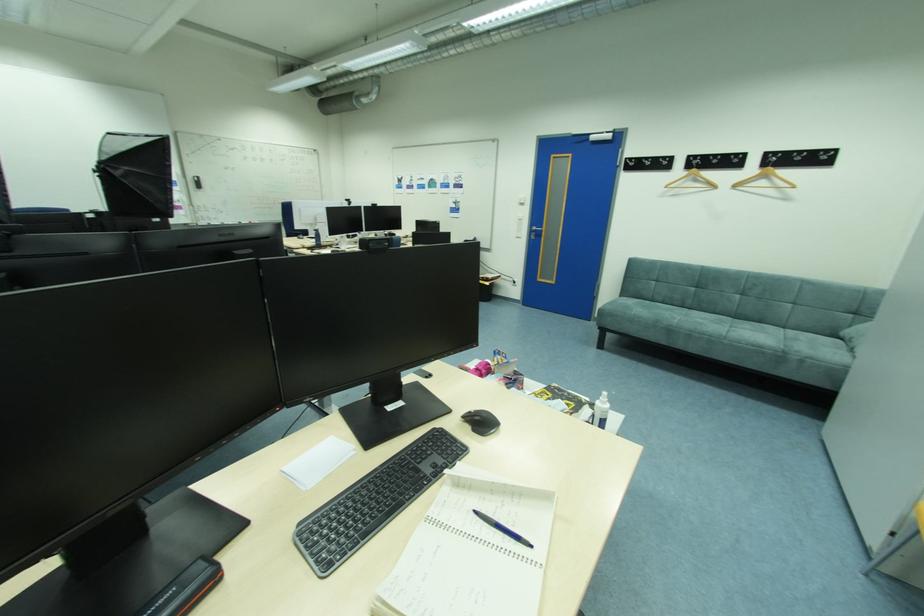
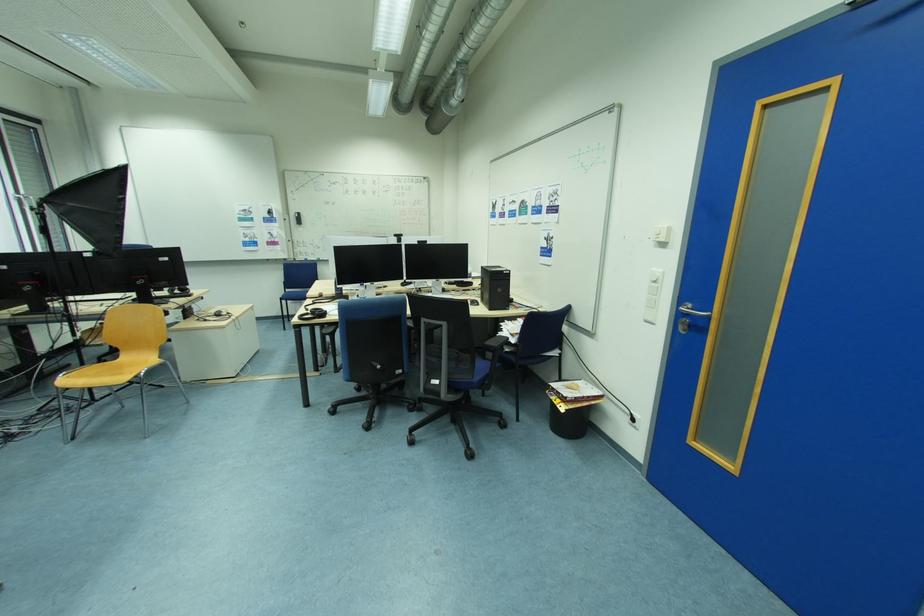
Find the pixel in the second image that matches point 541,232 in the first image.

(695, 315)